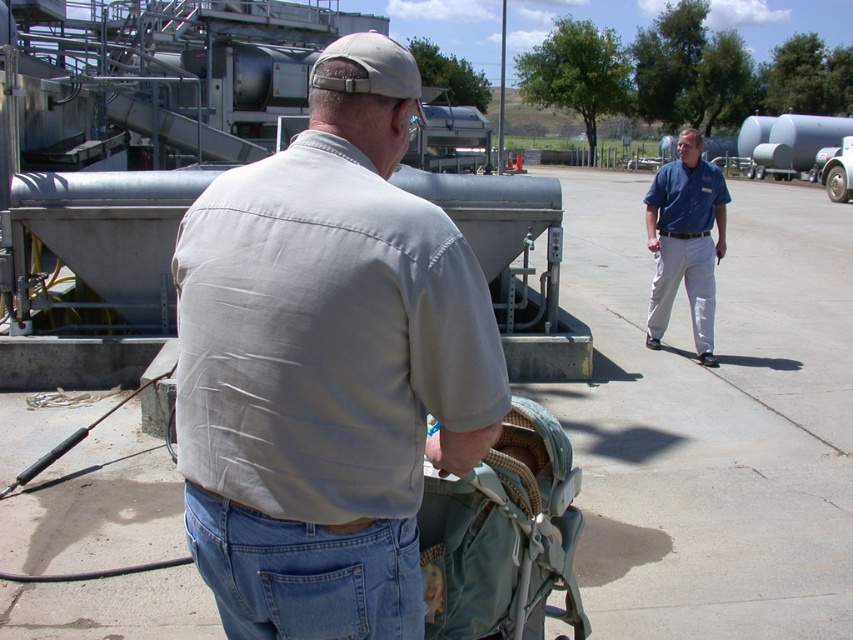
You are standing in the industrial area and need to walk from the concrete at center to the light gray cotton shirt at center. Which direction should you move relative to the shirt?

Since the concrete at center is further to the viewer than the light gray cotton shirt at center, you should move towards the shirt by walking forward from the concrete towards the shirt.

You are standing at the camera position and want to locate the light gray cotton shirt at center. What are its coordinates in the image?

The light gray cotton shirt at center is located at coordinates point (328, 365).